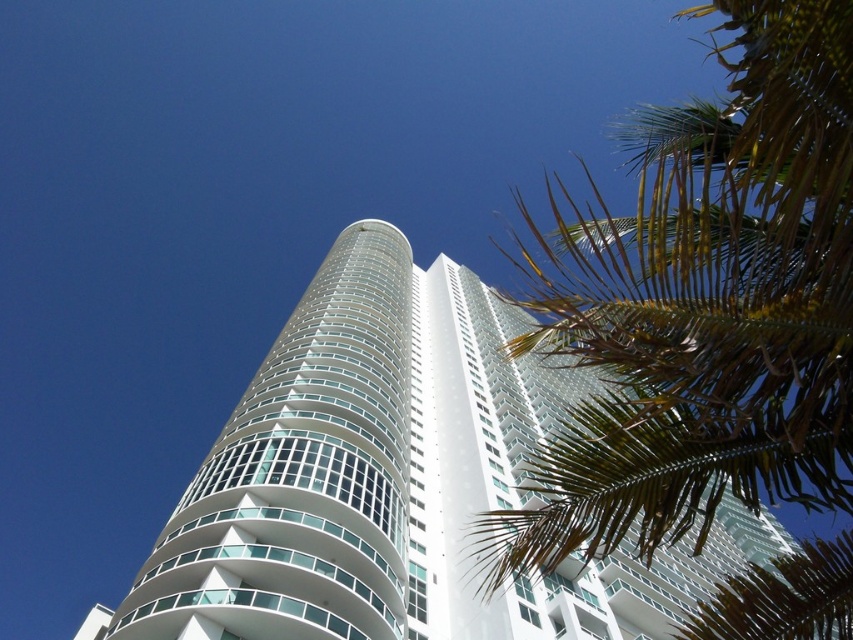
Question: Is green leafy palm tree at upper right closer to camera compared to white glass building at center?

Choices:
 (A) no
 (B) yes

Answer: (B)

Question: Does green leafy palm tree at upper right have a lesser width compared to white glass building at center?

Choices:
 (A) yes
 (B) no

Answer: (A)

Question: Which of the following is the farthest from the observer?

Choices:
 (A) green leafy palm tree at upper right
 (B) white glass building at center

Answer: (B)

Question: Which point is farther from the camera taking this photo?

Choices:
 (A) (756, 128)
 (B) (370, 593)

Answer: (B)

Question: Is green leafy palm tree at upper right bigger than white glass building at center?

Choices:
 (A) yes
 (B) no

Answer: (A)